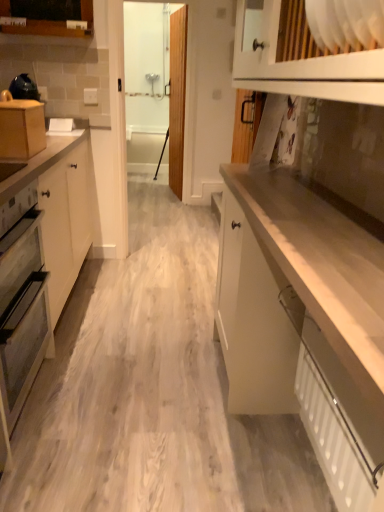
Question: Is white matte cabinet at center, the 3th cabinetry viewed from the back, positioned behind matte gray oven at left?

Choices:
 (A) no
 (B) yes

Answer: (A)

Question: From a real-world perspective, is white matte cabinet at center, positioned as the third cabinetry in left-to-right order, beneath matte gray oven at left?

Choices:
 (A) yes
 (B) no

Answer: (A)

Question: Could matte gray oven at left be considered to be inside white matte cabinet at center, positioned as the third cabinetry in left-to-right order?

Choices:
 (A) yes
 (B) no

Answer: (B)

Question: From the image's perspective, would you say white matte cabinet at center, the 3th cabinetry viewed from the back, is positioned over matte gray oven at left?

Choices:
 (A) no
 (B) yes

Answer: (A)

Question: Can you confirm if white matte cabinet at center, marked as the 1th cabinetry in a bottom-to-top arrangement, is smaller than matte gray oven at left?

Choices:
 (A) no
 (B) yes

Answer: (A)

Question: From the image's perspective, relative to wooden cabinet at upper left, the third cabinetry in the front-to-back sequence, is transparent glass door at upper center above or below?

Choices:
 (A) below
 (B) above

Answer: (B)

Question: Is transparent glass door at upper center wider or thinner than wooden cabinet at upper left, which is counted as the 3th cabinetry, starting from the bottom?

Choices:
 (A) thin
 (B) wide

Answer: (A)

Question: From a real-world perspective, relative to wooden cabinet at upper left, the 1th cabinetry viewed from the back, is transparent glass door at upper center vertically above or below?

Choices:
 (A) above
 (B) below

Answer: (B)

Question: Is transparent glass door at upper center bigger or smaller than wooden cabinet at upper left, the 1th cabinetry viewed from the back?

Choices:
 (A) big
 (B) small

Answer: (A)

Question: Is matte wood box at left, which is the second cabinetry in left-to-right order, to the left or to the right of wooden cabinet at upper left, which is the 1th cabinetry from top to bottom, in the image?

Choices:
 (A) right
 (B) left

Answer: (A)

Question: From the image's perspective, relative to wooden cabinet at upper left, which is the 1th cabinetry from top to bottom, is matte wood box at left, marked as the second cabinetry in a top-to-bottom arrangement, above or below?

Choices:
 (A) above
 (B) below

Answer: (B)

Question: Is matte wood box at left, which appears as the 2th cabinetry when viewed from the back, taller or shorter than wooden cabinet at upper left, the 1th cabinetry viewed from the back?

Choices:
 (A) short
 (B) tall

Answer: (B)

Question: From a real-world perspective, relative to wooden cabinet at upper left, which is counted as the third cabinetry, starting from the right, is matte wood box at left, which appears as the 2th cabinetry when viewed from the back, vertically above or below?

Choices:
 (A) above
 (B) below

Answer: (B)

Question: Would you say white matte cabinet at center, the 3th cabinetry from the top, is to the left or to the right of matte gray oven at left in the picture?

Choices:
 (A) right
 (B) left

Answer: (A)

Question: Is white matte cabinet at center, positioned as the third cabinetry in left-to-right order, bigger or smaller than matte gray oven at left?

Choices:
 (A) small
 (B) big

Answer: (B)